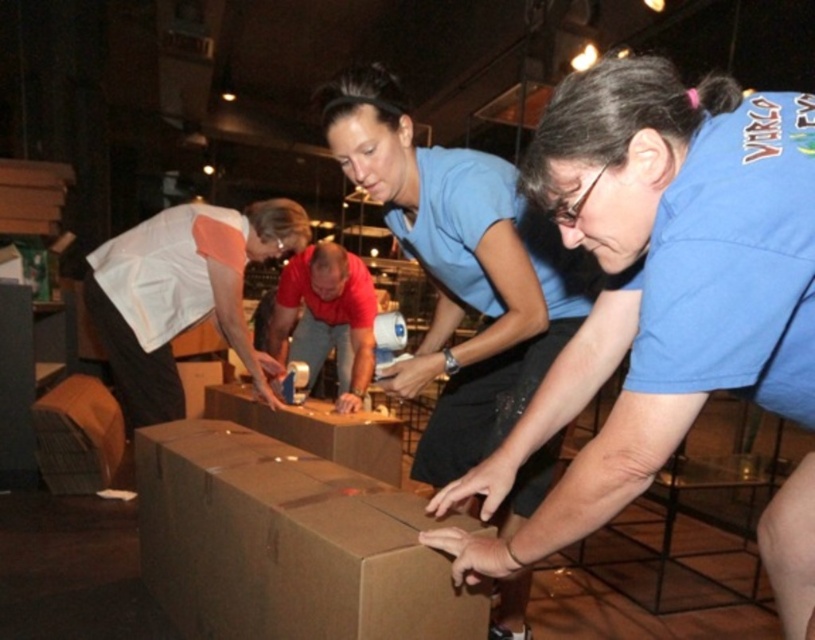
You are an observer in the warehouse. You notice two people at the center of the scene wearing shirts labeled as the blue matte shirt at center and the red fabric shirt at center. Which person has a wider torso?

The blue matte shirt at center has a larger width than the red fabric shirt at center, so the person wearing the blue matte shirt at center has a wider torso.

Looking at this image, you are standing at the entrance of the warehouse and need to locate the brown cardboard box at center. According to the coordinates provided, in which area of the image should you look to find it?

The brown cardboard box at center is located at point coordinates 0.850 on the x axis and 0.352 on the y axis, so you should look towards the right side and lower middle area of the image.